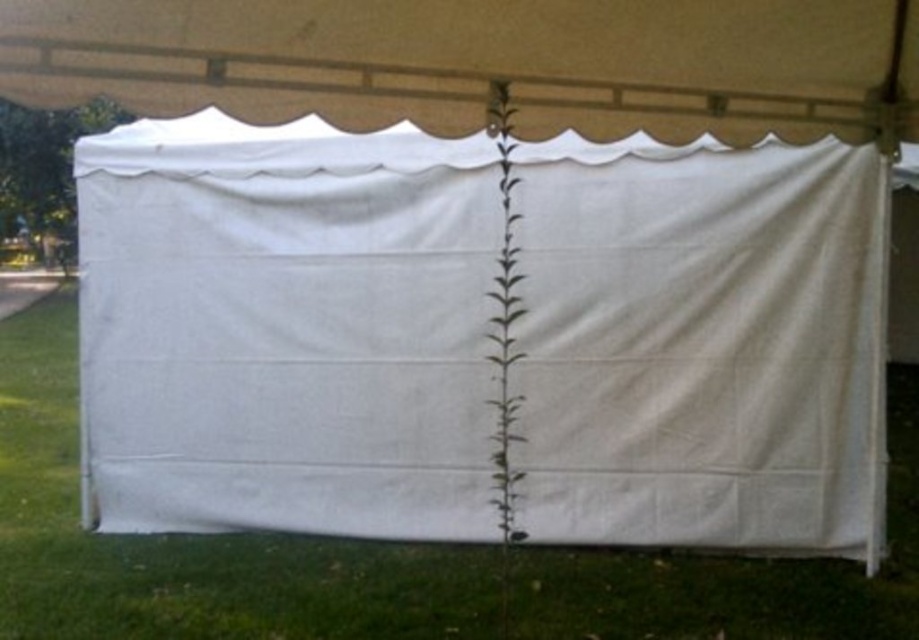
Question: Can you confirm if white fabric canopy at upper center is wider than green leafy plant at center?

Choices:
 (A) no
 (B) yes

Answer: (B)

Question: Which of these objects is positioned farthest from the green leafy plant at center?

Choices:
 (A) white fabric canopy at upper center
 (B) green grass at lower center

Answer: (B)

Question: Which point is closer to the camera?

Choices:
 (A) (492, 109)
 (B) (462, 20)
 (C) (620, 620)

Answer: (B)

Question: Is green grass at lower center bigger than green leafy plant at center?

Choices:
 (A) yes
 (B) no

Answer: (A)

Question: Which of the following is the farthest from the observer?

Choices:
 (A) (366, 564)
 (B) (505, 317)
 (C) (471, 38)

Answer: (B)

Question: Can you confirm if white fabric canopy at upper center is positioned above green leafy plant at center?

Choices:
 (A) no
 (B) yes

Answer: (B)